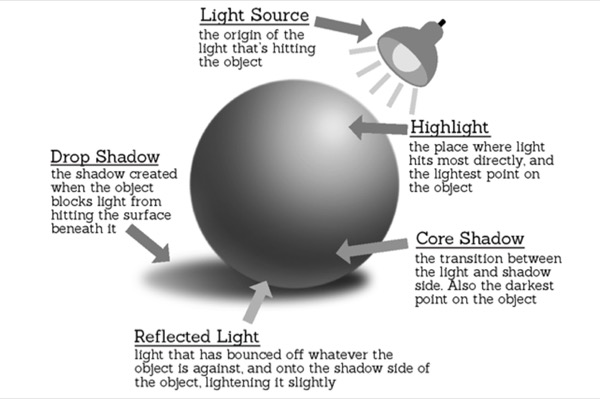
Locate an element on the screen. light housing is located at coordinates (425, 40).